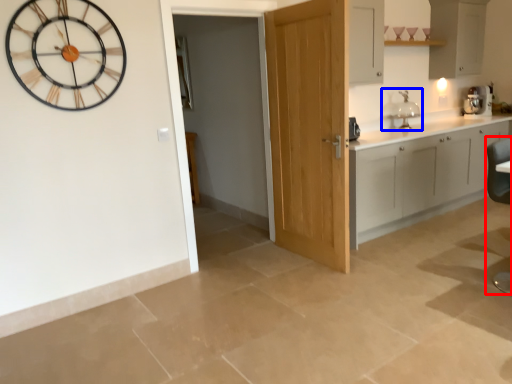
Question: Which of the following is the farthest to the observer, swivel chair (highlighted by a red box) or sink (highlighted by a blue box)?

Choices:
 (A) swivel chair
 (B) sink

Answer: (B)